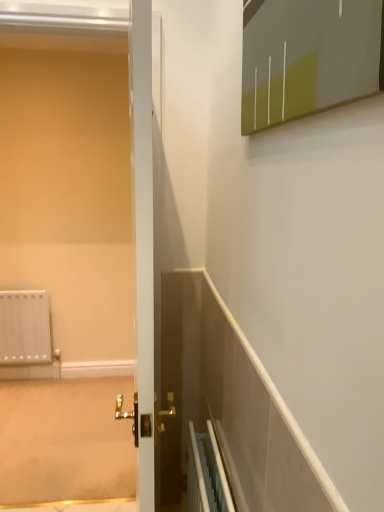
Image resolution: width=384 pixels, height=512 pixels. Describe the element at coordinates (71, 203) in the screenshot. I see `matte white screen door at left` at that location.

Locate an element on the screen. matte white screen door at left is located at coordinates (x=71, y=203).

Measure the distance between point (44, 131) and camera.

The depth of point (44, 131) is 8.86 feet.

Locate an element on the screen. The width and height of the screenshot is (384, 512). matte gray medicine cabinet at upper right is located at coordinates (307, 57).

Describe the element at coordinates (307, 57) in the screenshot. The height and width of the screenshot is (512, 384). I see `matte gray medicine cabinet at upper right` at that location.

The width and height of the screenshot is (384, 512). Find the location of `matte white screen door at left`. matte white screen door at left is located at coordinates (71, 203).

Between matte white screen door at left and matte gray medicine cabinet at upper right, which one appears on the left side from the viewer's perspective?

From the viewer's perspective, matte white screen door at left appears more on the left side.

In the image, is matte white screen door at left positioned in front of or behind matte gray medicine cabinet at upper right?

matte white screen door at left is positioned farther from the viewer than matte gray medicine cabinet at upper right.

Considering the positions of points (89, 405) and (340, 92), is point (89, 405) closer to camera compared to point (340, 92)?

No, it is behind (340, 92).

From the image's perspective, relative to matte gray medicine cabinet at upper right, is matte white screen door at left above or below?

Clearly, from the image's perspective, matte white screen door at left is below matte gray medicine cabinet at upper right.

From a real-world perspective, does matte white screen door at left stand above matte gray medicine cabinet at upper right?

No, from a real-world perspective, matte white screen door at left is not above matte gray medicine cabinet at upper right.

Is matte white screen door at left wider or thinner than matte gray medicine cabinet at upper right?

Considering their sizes, matte white screen door at left looks broader than matte gray medicine cabinet at upper right.

In terms of height, does matte white screen door at left look taller or shorter compared to matte gray medicine cabinet at upper right?

Clearly, matte white screen door at left is taller compared to matte gray medicine cabinet at upper right.

Considering the sizes of objects matte white screen door at left and matte gray medicine cabinet at upper right in the image provided, who is bigger, matte white screen door at left or matte gray medicine cabinet at upper right?

matte white screen door at left is bigger.

Would you say matte white screen door at left contains matte gray medicine cabinet at upper right?

No, matte white screen door at left does not contain matte gray medicine cabinet at upper right.

Is matte white screen door at left not close to matte gray medicine cabinet at upper right?

Result: Yes, matte white screen door at left and matte gray medicine cabinet at upper right are quite far apart.

Is matte white screen door at left turned away from matte gray medicine cabinet at upper right?

That's not correct — matte white screen door at left is not looking away from matte gray medicine cabinet at upper right.

Can you tell me how much matte white screen door at left and matte gray medicine cabinet at upper right differ in facing direction?

The facing directions of matte white screen door at left and matte gray medicine cabinet at upper right are 90.4 degrees apart.

Locate an element on the screen. medicine cabinet lying on the right of matte white screen door at left is located at coordinates (307, 57).

Does matte gray medicine cabinet at upper right appear on the left side of matte white screen door at left?

No.

Is matte gray medicine cabinet at upper right positioned behind matte white screen door at left?

No.

Is point (359, 57) positioned in front of point (104, 318)?

Yes.

From the image's perspective, is matte gray medicine cabinet at upper right under matte white screen door at left?

Actually, matte gray medicine cabinet at upper right appears above matte white screen door at left in the image.

From a real-world perspective, relative to matte white screen door at left, is matte gray medicine cabinet at upper right vertically above or below?

matte gray medicine cabinet at upper right is situated higher than matte white screen door at left in the real world.

Can you confirm if matte gray medicine cabinet at upper right is wider than matte white screen door at left?

No, matte gray medicine cabinet at upper right is not wider than matte white screen door at left.

Who is shorter, matte gray medicine cabinet at upper right or matte white screen door at left?

Standing shorter between the two is matte gray medicine cabinet at upper right.

Considering the sizes of objects matte gray medicine cabinet at upper right and matte white screen door at left in the image provided, who is bigger, matte gray medicine cabinet at upper right or matte white screen door at left?

matte white screen door at left.

Could matte white screen door at left be considered to be inside matte gray medicine cabinet at upper right?

No, matte gray medicine cabinet at upper right does not contain matte white screen door at left.

Does matte gray medicine cabinet at upper right touch matte white screen door at left?

No, matte gray medicine cabinet at upper right is not with matte white screen door at left.

Consider the image. Is matte white screen door at left at the back of matte gray medicine cabinet at upper right?

No, matte gray medicine cabinet at upper right is not facing the opposite direction of matte white screen door at left.

The height and width of the screenshot is (512, 384). Find the location of `medicine cabinet that is on the right side of matte white screen door at left`. medicine cabinet that is on the right side of matte white screen door at left is located at coordinates (307, 57).

Where is `medicine cabinet on the right of matte white screen door at left`? This screenshot has width=384, height=512. medicine cabinet on the right of matte white screen door at left is located at coordinates (307, 57).

The height and width of the screenshot is (512, 384). I want to click on medicine cabinet above the matte white screen door at left (from the image's perspective), so click(x=307, y=57).